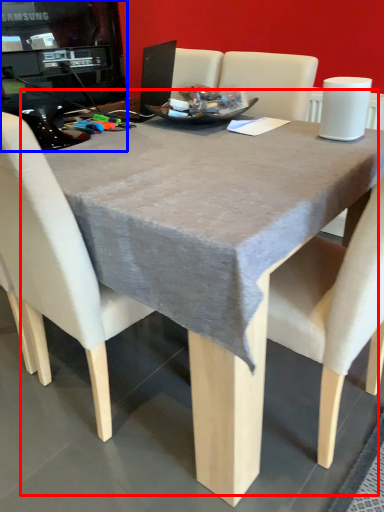
Question: Which of the following is the closest to the observer, table (highlighted by a red box) or desktop computer (highlighted by a blue box)?

Choices:
 (A) table
 (B) desktop computer

Answer: (A)